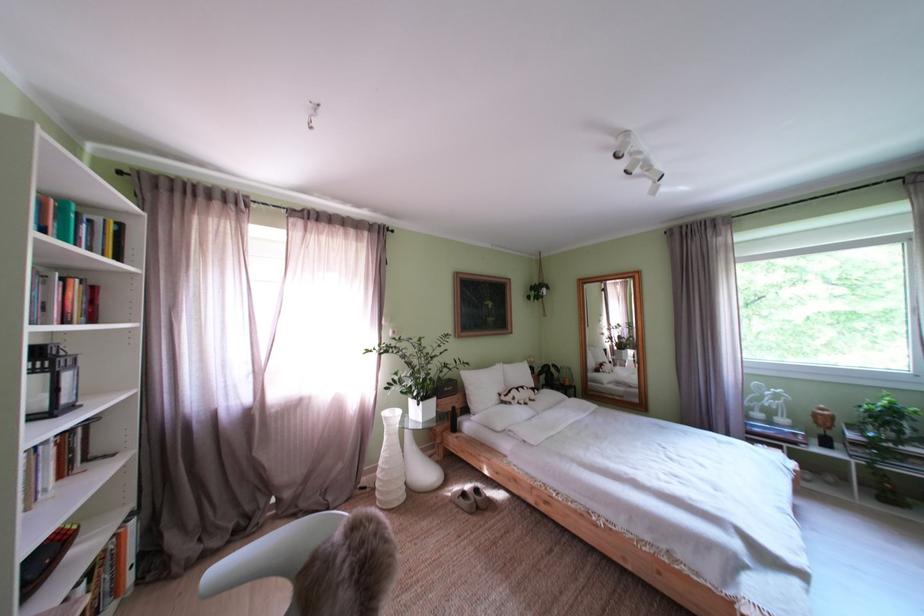
Which object does [508,414] point to?

This point indicates the white bed pillow.